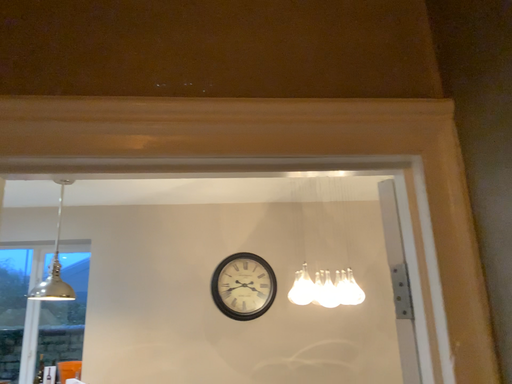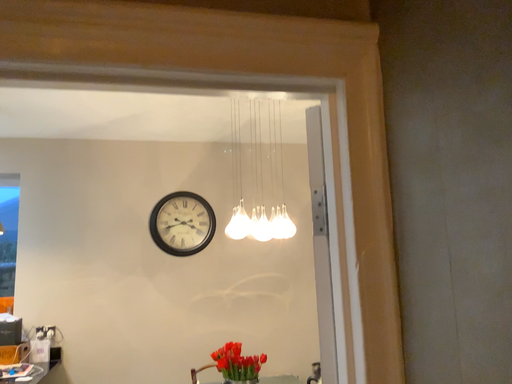
Question: Which way did the camera rotate in the video?

Choices:
 (A) rotated left
 (B) rotated right

Answer: (B)